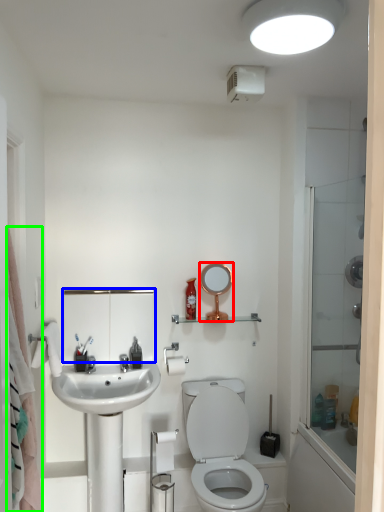
Question: Which is nearer to the mirror (highlighted by a red box)? medicine cabinet (highlighted by a blue box) or shower curtain (highlighted by a green box).

Choices:
 (A) medicine cabinet
 (B) shower curtain

Answer: (A)